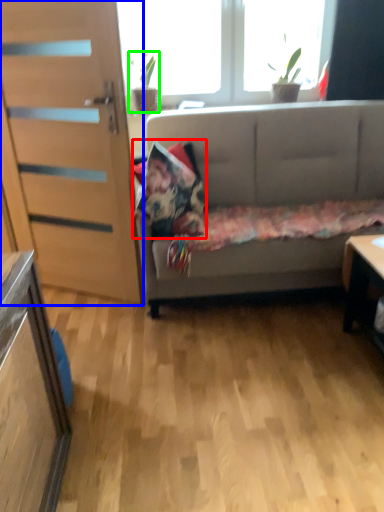
Question: Which object is positioned farthest from pillow (highlighted by a red box)? Select from door (highlighted by a blue box) and houseplant (highlighted by a green box).

Choices:
 (A) door
 (B) houseplant

Answer: (B)